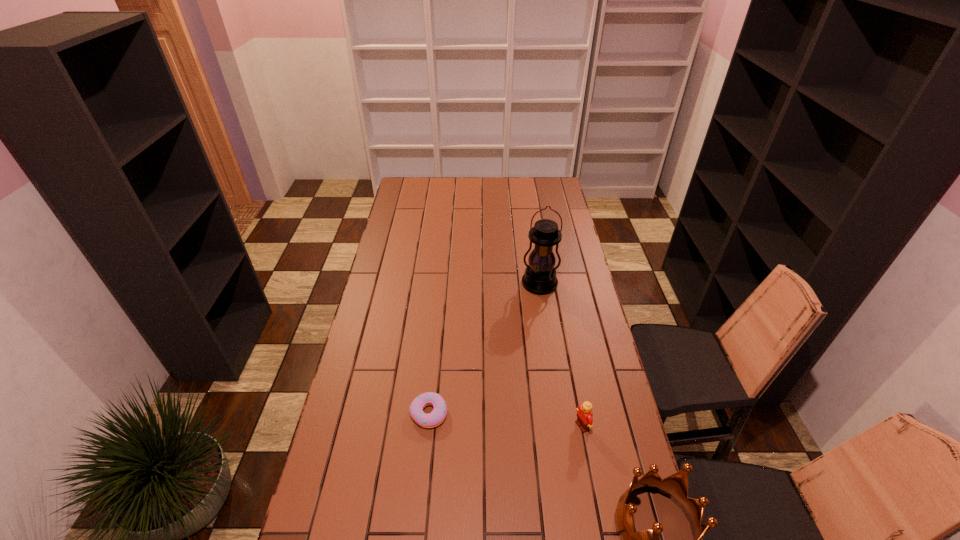
At what (x,y) coordinates should I click in order to perform the action: click on vacant space located on the face of the third tallest object. Please return your answer as a coordinate pair (x, y). The height and width of the screenshot is (540, 960). Looking at the image, I should click on (508, 464).

Identify the location of blank space located 0.140m on the face of the third tallest object. The width and height of the screenshot is (960, 540). (538, 449).

Image resolution: width=960 pixels, height=540 pixels. I want to click on lantern at the right edge, so click(x=540, y=278).

You are a GUI agent. You are given a task and a screenshot of the screen. Output one action in this format:
    pyautogui.click(x=<x>, y=<y>)
    Task: Click on the Lego located at the right edge
    
    Given the screenshot: What is the action you would take?
    pyautogui.click(x=584, y=420)

In the image, there is a desktop. What are the coordinates of `free region at the far edge` in the screenshot? It's located at (514, 190).

The height and width of the screenshot is (540, 960). I want to click on free space at the near edge of the desktop, so click(x=373, y=523).

The height and width of the screenshot is (540, 960). Find the location of `vacant space at the left edge of the desktop`. vacant space at the left edge of the desktop is located at coordinates (395, 257).

Image resolution: width=960 pixels, height=540 pixels. In order to click on free space at the right edge of the desktop in this screenshot , I will do `click(563, 236)`.

In the image, there is a desktop. At what (x,y) coordinates should I click in order to perform the action: click on blank space at the far right corner. Please return your answer as a coordinate pair (x, y). This screenshot has height=540, width=960. Looking at the image, I should click on (556, 177).

The image size is (960, 540). I want to click on empty space between the tallest object and the third tallest object, so click(561, 355).